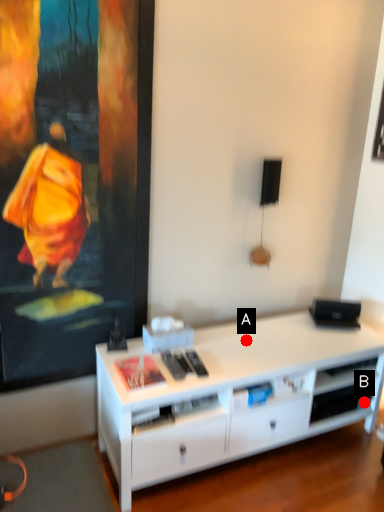
Question: Two points are circled on the image, labeled by A and B beside each circle. Which of the following is the closest to the observer?

Choices:
 (A) A is closer
 (B) B is closer

Answer: (A)